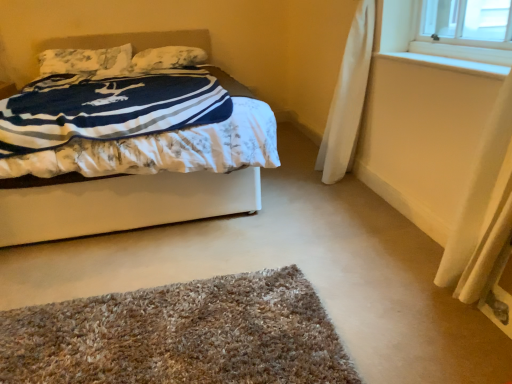
Identify the location of free space to the right of brown shaggy rug at lower center. This screenshot has width=512, height=384. (381, 290).